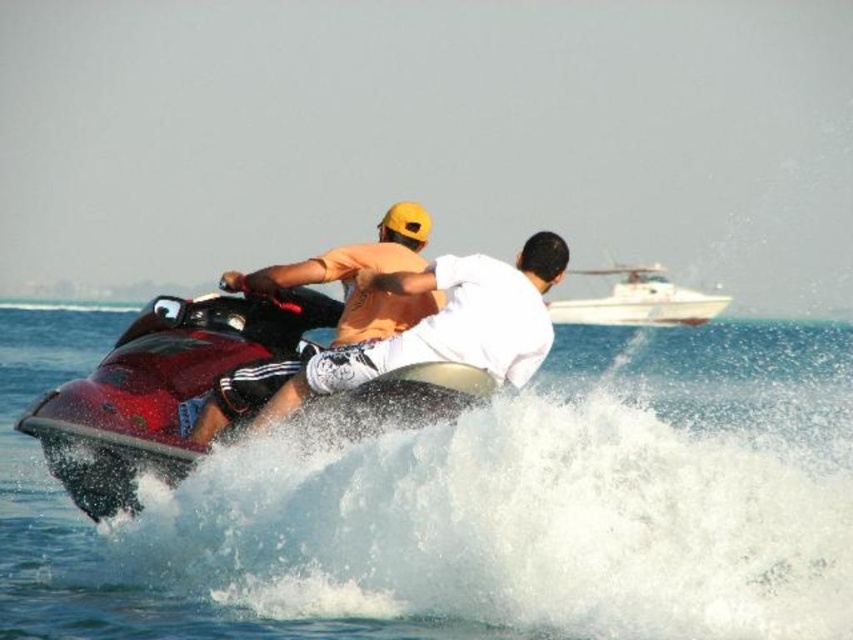
Based on the photo, how much distance is there between shiny red jet ski at center and white glossy boat at upper center?

They are 347.09 feet apart.

In order to click on shiny red jet ski at center in this screenshot , I will do `click(160, 388)`.

Is point (215, 323) farther from camera compared to point (720, 294)?

No, (215, 323) is in front of (720, 294).

This screenshot has width=853, height=640. Identify the location of shiny red jet ski at center. (160, 388).

Between clear water at jet ski center and matte orange helmet at upper center, which one appears on the left side from the viewer's perspective?

Positioned to the left is matte orange helmet at upper center.

Identify the location of clear water at jet ski center. (473, 504).

Can you confirm if shiny red jet ski at center is positioned to the left of matte orange helmet at upper center?

Correct, you'll find shiny red jet ski at center to the left of matte orange helmet at upper center.

Does point (310, 328) come closer to viewer compared to point (335, 369)?

No, it is behind (335, 369).

Where is `shiny red jet ski at center`? shiny red jet ski at center is located at coordinates pyautogui.click(x=160, y=388).

The height and width of the screenshot is (640, 853). I want to click on shiny red jet ski at center, so click(160, 388).